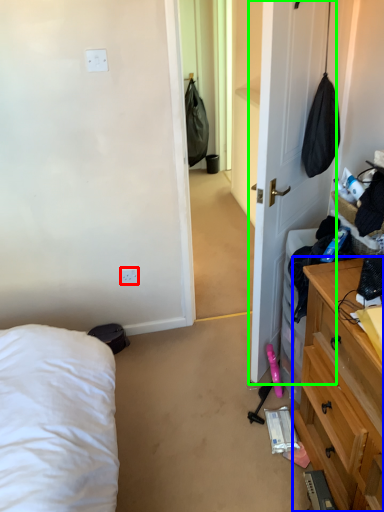
Question: Which object is the farthest from electric outlet (highlighted by a red box)? Choose among these: cabinetry (highlighted by a blue box) or door (highlighted by a green box).

Choices:
 (A) cabinetry
 (B) door

Answer: (A)